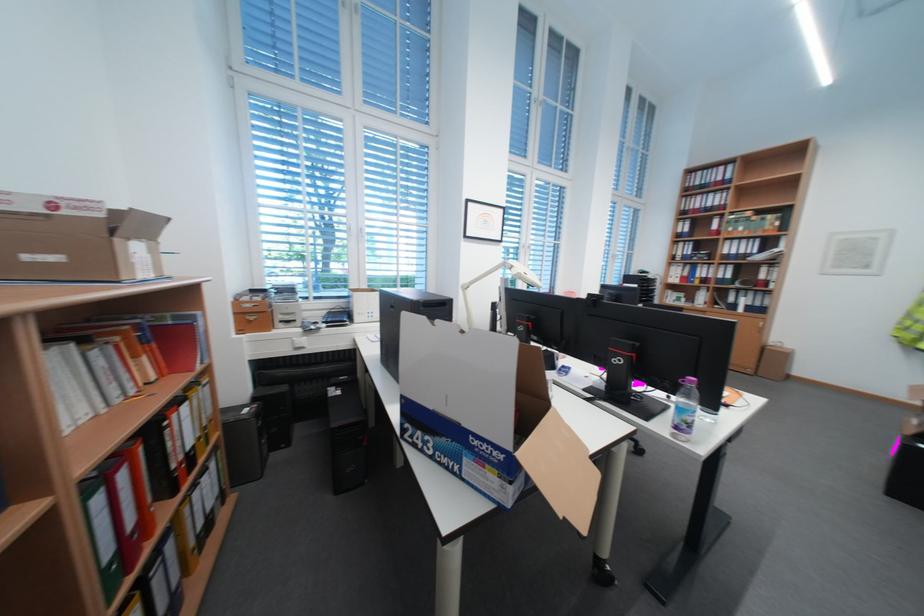
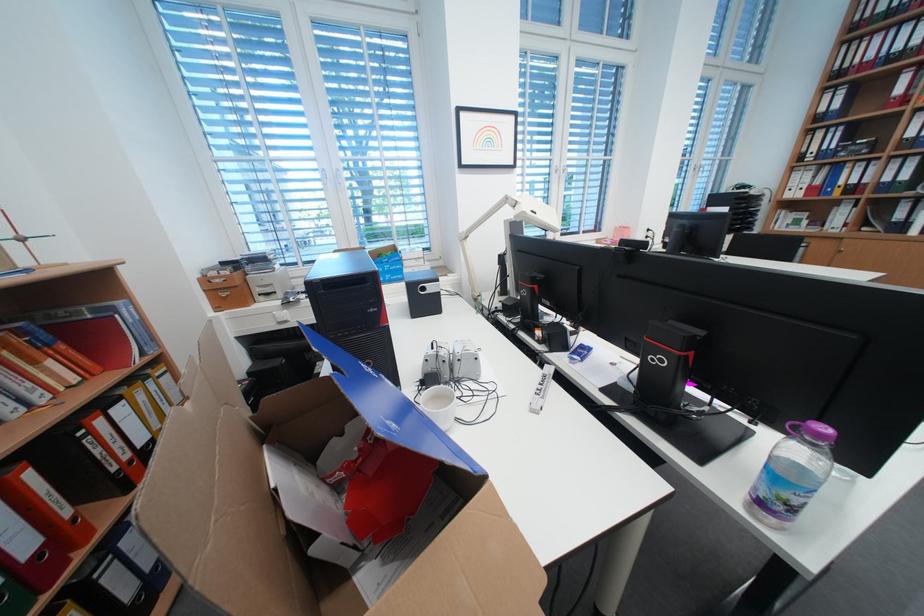
What movement of the cameraman would produce the second image?

The movement direction of the cameraman is right, forward.